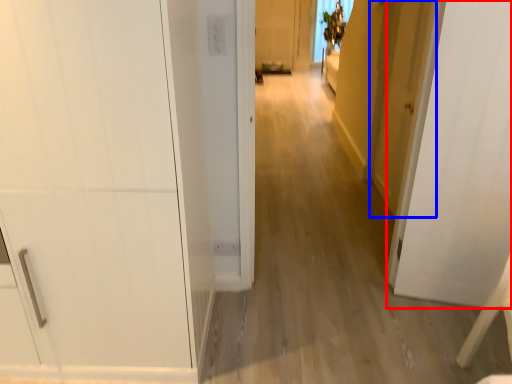
Question: Which object appears farthest to the camera in this image, door (highlighted by a red box) or door (highlighted by a blue box)?

Choices:
 (A) door
 (B) door

Answer: (B)